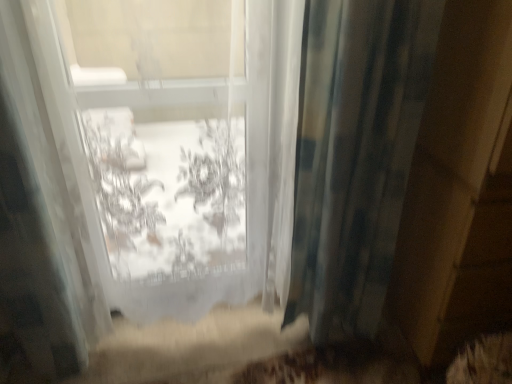
Question: Is transparent fabric at center situated inside blue textured curtain at right or outside?

Choices:
 (A) inside
 (B) outside

Answer: (B)

Question: Is point (209, 172) positioned closer to the camera than point (415, 38)?

Choices:
 (A) closer
 (B) farther

Answer: (B)

Question: Is transparent fabric at center wider or thinner than blue textured curtain at right?

Choices:
 (A) thin
 (B) wide

Answer: (B)

Question: Is point (419, 112) positioned closer to the camera than point (76, 129)?

Choices:
 (A) closer
 (B) farther

Answer: (B)

Question: From the image's perspective, is blue textured curtain at right located above or below transparent fabric at center?

Choices:
 (A) below
 (B) above

Answer: (A)

Question: Is blue textured curtain at right taller or shorter than transparent fabric at center?

Choices:
 (A) short
 (B) tall

Answer: (A)

Question: In terms of size, does blue textured curtain at right appear bigger or smaller than transparent fabric at center?

Choices:
 (A) small
 (B) big

Answer: (A)